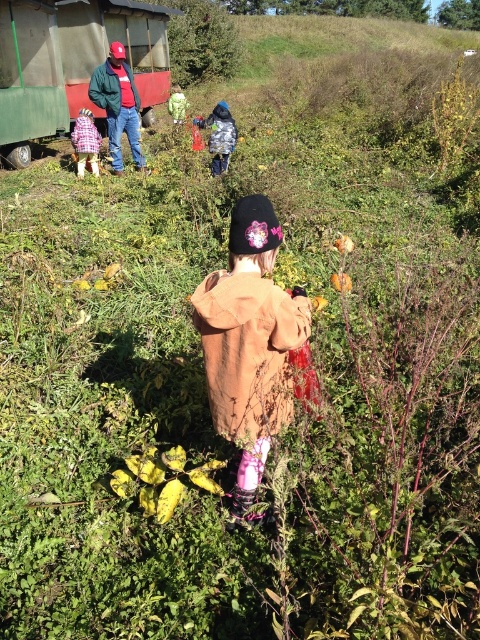
From the picture: Can you confirm if green weathered train car at upper left is bigger than reddish-brown leather jacket at upper left?

Yes.

Is green weathered train car at upper left above reddish-brown leather jacket at upper left?

Indeed, green weathered train car at upper left is positioned over reddish-brown leather jacket at upper left.

Which is behind, point (36, 109) or point (97, 72)?

The point (36, 109) is behind.

You are a GUI agent. You are given a task and a screenshot of the screen. Output one action in this format:
    pyautogui.click(x=<x>, y=<y>)
    Task: Click on the green weathered train car at upper left
    
    Given the screenshot: What is the action you would take?
    coord(72,61)

In the scene shown: Does fuzzy brown coat at center appear on the right side of green weathered train car at upper left?

Yes, fuzzy brown coat at center is to the right of green weathered train car at upper left.

Is fuzzy brown coat at center positioned before green weathered train car at upper left?

Yes, fuzzy brown coat at center is closer to the viewer.

Who is more forward, [192,296] or [136,13]?

Point [192,296]

Find the location of a particular element. The image size is (480, 640). fuzzy brown coat at center is located at coordinates (250, 342).

Locate an element on the screen. The image size is (480, 640). green weathered train car at upper left is located at coordinates (72, 61).

Does point (23, 128) come behind point (222, 116)?

That is True.

Where is `green weathered train car at upper left`? green weathered train car at upper left is located at coordinates (72, 61).